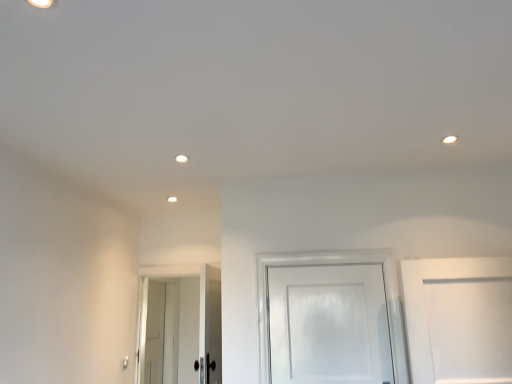
In order to click on white glossy door at lower left, arranged as the second door when viewed from the right in this screenshot , I will do coord(181,329).

Find the location of a particular element. The height and width of the screenshot is (384, 512). white glossy door at lower left, arranged as the second door when viewed from the right is located at coordinates (181, 329).

From the image's perspective, which object appears higher, white glossy door at lower left, which appears as the 2th door when viewed from the left, or white glossy door at lower left, which ranks as the third door in right-to-left order?

white glossy door at lower left, which appears as the 2th door when viewed from the left, from the image's perspective.

Considering the sizes of objects white glossy door at lower left, the 2th door in the front-to-back sequence, and white glossy door at lower left, marked as the first door in a back-to-front arrangement, in the image provided, who is wider, white glossy door at lower left, the 2th door in the front-to-back sequence, or white glossy door at lower left, marked as the first door in a back-to-front arrangement,?

With larger width is white glossy door at lower left, the 2th door in the front-to-back sequence.

Measure the distance from white glossy door at lower left, which appears as the 2th door when viewed from the left, to white glossy door at lower left, which ranks as the third door in right-to-left order.

They are 3.19 inches apart.

Is white glossy door at lower left, the second door from the back, oriented away from white glossy door at lower left, the third door when ordered from front to back?

Correct, white glossy door at lower left, the second door from the back, is looking away from white glossy door at lower left, the third door when ordered from front to back.

Does white glossy door at center, the 3th door positioned from the left, have a larger size compared to white glossy door at lower left, which ranks as the third door in right-to-left order?

No.

Based on their positions, is white glossy door at center, the 3th door positioned from the left, located to the left or right of white glossy door at lower left, marked as the first door in a back-to-front arrangement?

Based on their positions, white glossy door at center, the 3th door positioned from the left, is located to the right of white glossy door at lower left, marked as the first door in a back-to-front arrangement.

Can you confirm if white glossy door at center, the first door viewed from the right, is wider than white glossy door at lower left, the 1th door when ordered from left to right?

No.

From a real-world perspective, which is physically below, white glossy door at center, the first door viewed from the right, or white glossy door at lower left, the 1th door when ordered from left to right?

From a 3D spatial view, white glossy door at lower left, the 1th door when ordered from left to right, is below.

From a real-world perspective, is white glossy door at lower left, the 1th door when ordered from left to right, under white glossy door at lower left, the second door from the back?

Yes, from a real-world perspective, white glossy door at lower left, the 1th door when ordered from left to right, is beneath white glossy door at lower left, the second door from the back.

Choose the correct answer: Is white glossy door at lower left, the 1th door when ordered from left to right, inside white glossy door at lower left, arranged as the second door when viewed from the right, or outside it?

white glossy door at lower left, the 1th door when ordered from left to right, is not enclosed by white glossy door at lower left, arranged as the second door when viewed from the right.

Starting from the white glossy door at lower left, the third door when ordered from front to back, which door is the 1st one to the right? Please provide its 2D coordinates.

[(181, 329)]

Does white glossy door at lower left, marked as the first door in a back-to-front arrangement, turn towards white glossy door at lower left, the second door from the back?

No.

Considering the relative sizes of white glossy door at center, arranged as the 3th door when viewed from the back, and white glossy door at lower left, the second door from the back, in the image provided, is white glossy door at center, arranged as the 3th door when viewed from the back, shorter than white glossy door at lower left, the second door from the back,?

Yes.

Is point (355, 265) behind point (153, 349)?

No, (355, 265) is in front of (153, 349).

Looking at this image, is white glossy door at center, which appears as the 1th door when viewed from the front, beside white glossy door at lower left, arranged as the second door when viewed from the right?

white glossy door at center, which appears as the 1th door when viewed from the front, is not next to white glossy door at lower left, arranged as the second door when viewed from the right, and they're not touching.

From a real-world perspective, is white glossy door at center, arranged as the 3th door when viewed from the back, under white glossy door at lower left, arranged as the second door when viewed from the right?

Actually, white glossy door at center, arranged as the 3th door when viewed from the back, is physically above white glossy door at lower left, arranged as the second door when viewed from the right, in the real world.

This screenshot has width=512, height=384. I want to click on door that is the 1st one when counting backward from the white glossy door at center, the 3th door positioned from the left, so click(181, 329).

From the image's perspective, would you say white glossy door at lower left, which appears as the 2th door when viewed from the left, is positioned over white glossy door at center, which appears as the 1th door when viewed from the front?

Incorrect, from the image's perspective, white glossy door at lower left, which appears as the 2th door when viewed from the left, is lower than white glossy door at center, which appears as the 1th door when viewed from the front.

Measure the distance between white glossy door at lower left, the 2th door in the front-to-back sequence, and white glossy door at center, the 3th door positioned from the left.

The distance of white glossy door at lower left, the 2th door in the front-to-back sequence, from white glossy door at center, the 3th door positioned from the left, is 6.01 feet.

Is white glossy door at lower left, arranged as the second door when viewed from the right, not within white glossy door at center, the first door viewed from the right?

Indeed, white glossy door at lower left, arranged as the second door when viewed from the right, is completely outside white glossy door at center, the first door viewed from the right.

Is white glossy door at lower left, which ranks as the third door in right-to-left order, oriented towards white glossy door at center, the first door viewed from the right?

No, white glossy door at lower left, which ranks as the third door in right-to-left order, does not turn towards white glossy door at center, the first door viewed from the right.

From a real-world perspective, which object stands above the other?

white glossy door at center, arranged as the 3th door when viewed from the back, from a real-world perspective.

Identify the location of door that is the 1st one when counting rightward from the white glossy door at lower left, the 1th door when ordered from left to right. The image size is (512, 384). (181, 329).

The image size is (512, 384). In order to click on the 2nd door in front of the white glossy door at lower left, the third door when ordered from front to back, counting from the anchor's position in this screenshot , I will do `click(328, 325)`.

From the image, which object appears to be nearer to white glossy door at lower left, the third door when ordered from front to back, white glossy door at lower left, which appears as the 2th door when viewed from the left, or white glossy door at center, arranged as the 3th door when viewed from the back?

The object closer to white glossy door at lower left, the third door when ordered from front to back, is white glossy door at lower left, which appears as the 2th door when viewed from the left.

Estimate the real-world distances between objects in this image. Which object is further from white glossy door at lower left, which appears as the 2th door when viewed from the left, white glossy door at lower left, which ranks as the third door in right-to-left order, or white glossy door at center, arranged as the 3th door when viewed from the back?

Among the two, white glossy door at center, arranged as the 3th door when viewed from the back, is located further to white glossy door at lower left, which appears as the 2th door when viewed from the left.

Which object lies nearer to the anchor point white glossy door at lower left, the third door when ordered from front to back, white glossy door at center, the 3th door positioned from the left, or white glossy door at lower left, which appears as the 2th door when viewed from the left?

The object closer to white glossy door at lower left, the third door when ordered from front to back, is white glossy door at lower left, which appears as the 2th door when viewed from the left.

Considering their positions, is white glossy door at lower left, the third door when ordered from front to back, positioned further to white glossy door at center, which appears as the 1th door when viewed from the front, than white glossy door at lower left, which appears as the 2th door when viewed from the left?

white glossy door at lower left, the third door when ordered from front to back.

Which object lies nearer to the anchor point white glossy door at lower left, the second door from the back, white glossy door at center, the first door viewed from the right, or white glossy door at lower left, marked as the first door in a back-to-front arrangement?

white glossy door at lower left, marked as the first door in a back-to-front arrangement, is closer to white glossy door at lower left, the second door from the back.

When comparing their distances from white glossy door at center, which appears as the 1th door when viewed from the front, does white glossy door at lower left, arranged as the second door when viewed from the right, or white glossy door at lower left, marked as the first door in a back-to-front arrangement, seem closer?

white glossy door at lower left, arranged as the second door when viewed from the right, is closer to white glossy door at center, which appears as the 1th door when viewed from the front.

At what (x,y) coordinates should I click in order to perform the action: click on door situated between white glossy door at lower left, the third door when ordered from front to back, and white glossy door at center, arranged as the 3th door when viewed from the back, from left to right. Please return your answer as a coordinate pair (x, y). The width and height of the screenshot is (512, 384). Looking at the image, I should click on (181, 329).